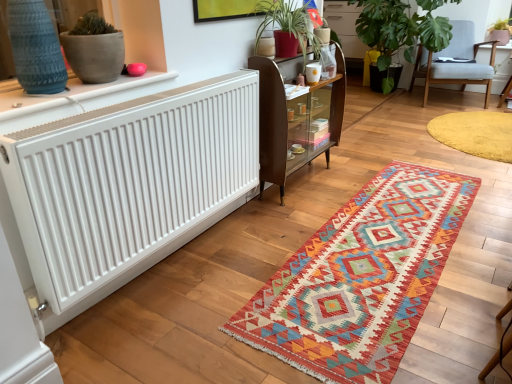
Question: From the image's perspective, is yellow plush rug at lower right, the first mat when ordered from back to front, located above or below wooden glass-fronted cabinet at center?

Choices:
 (A) above
 (B) below

Answer: (A)

Question: From a real-world perspective, relative to wooden glass-fronted cabinet at center, is yellow plush rug at lower right, placed as the first mat when sorted from right to left, vertically above or below?

Choices:
 (A) above
 (B) below

Answer: (B)

Question: Considering the real-world distances, which object is closest to the green leafy plant at upper right, the 1th houseplant when ordered from left to right?

Choices:
 (A) wooden glass-fronted cabinet at center
 (B) white textured radiator at upper left
 (C) pink matte pot at upper right, which is counted as the 2th houseplant, starting from the left
 (D) light gray fabric chair at upper right
 (E) knitted woolen rug at center, which ranks as the first mat in front-to-back order

Answer: (D)

Question: Which object is positioned farthest from the green leafy plant at upper right, the 2th houseplant when ordered from right to left?

Choices:
 (A) knitted woolen rug at center, which is the 1th mat from bottom to top
 (B) wooden glass-fronted cabinet at center
 (C) light gray fabric chair at upper right
 (D) pink matte pot at upper right, which is counted as the 2th houseplant, starting from the left
 (E) white matte radiator at left

Answer: (E)